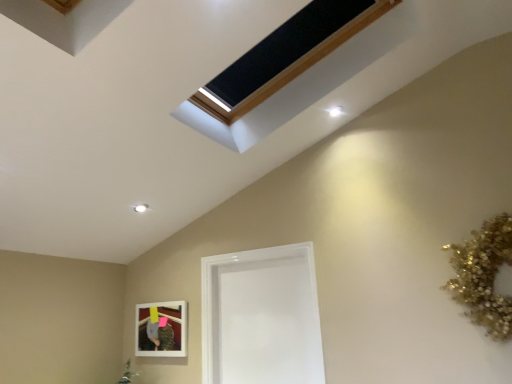
Question: In terms of height, does matte white picture frame at lower left look taller or shorter compared to transparent glass door at center?

Choices:
 (A) short
 (B) tall

Answer: (A)

Question: Which is correct: matte white picture frame at lower left is inside transparent glass door at center, or outside of it?

Choices:
 (A) outside
 (B) inside

Answer: (A)

Question: Considering the positions of point (177, 317) and point (266, 279), is point (177, 317) closer or farther from the camera than point (266, 279)?

Choices:
 (A) farther
 (B) closer

Answer: (A)

Question: Considering their positions, is transparent glass door at center located in front of or behind matte white picture frame at lower left?

Choices:
 (A) behind
 (B) front

Answer: (B)

Question: Looking at their shapes, would you say transparent glass door at center is wider or thinner than matte white picture frame at lower left?

Choices:
 (A) wide
 (B) thin

Answer: (A)

Question: From the image's perspective, is transparent glass door at center above or below matte white picture frame at lower left?

Choices:
 (A) below
 (B) above

Answer: (B)

Question: Considering the positions of transparent glass door at center and matte white picture frame at lower left in the image, is transparent glass door at center taller or shorter than matte white picture frame at lower left?

Choices:
 (A) tall
 (B) short

Answer: (A)